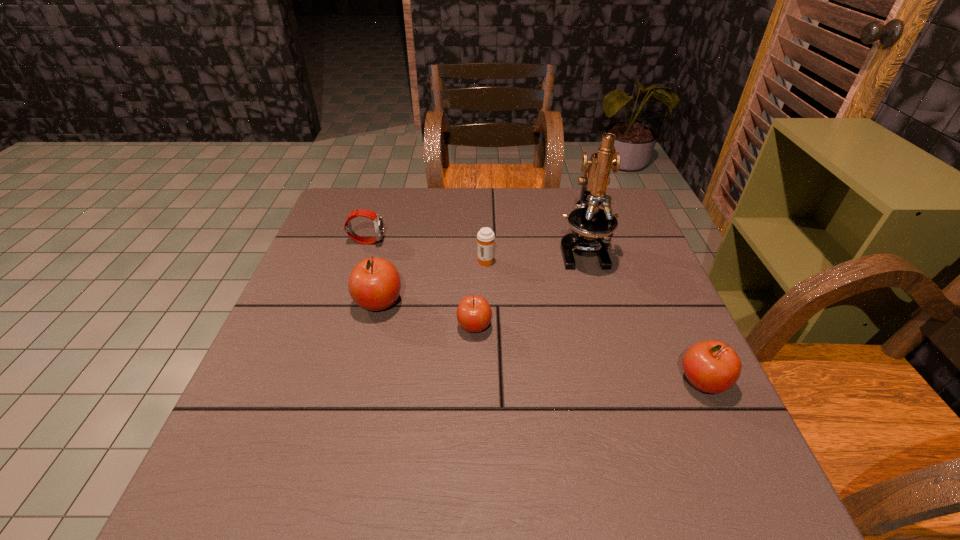
What are the coordinates of `the fifth shortest object` in the screenshot? It's located at (374, 284).

Find the location of `the tallest apple`. the tallest apple is located at coordinates (374, 284).

The image size is (960, 540). Identify the location of the second apple from right to left. (474, 314).

The image size is (960, 540). In order to click on the nearest apple in this screenshot , I will do `click(712, 366)`.

Find the location of a particular element. The width and height of the screenshot is (960, 540). the rightmost object is located at coordinates (712, 366).

You are a GUI agent. You are given a task and a screenshot of the screen. Output one action in this format:
    pyautogui.click(x=<x>, y=<y>)
    Task: Click on the tallest object
    
    Given the screenshot: What is the action you would take?
    pyautogui.click(x=588, y=222)

Locate an element on the screen. This screenshot has height=540, width=960. microscope is located at coordinates (588, 222).

Identify the location of medicine. The image size is (960, 540). (485, 236).

What are the coordinates of `watch` in the screenshot? It's located at (377, 219).

The width and height of the screenshot is (960, 540). Identify the location of free space located on the back of the leftmost apple. (390, 258).